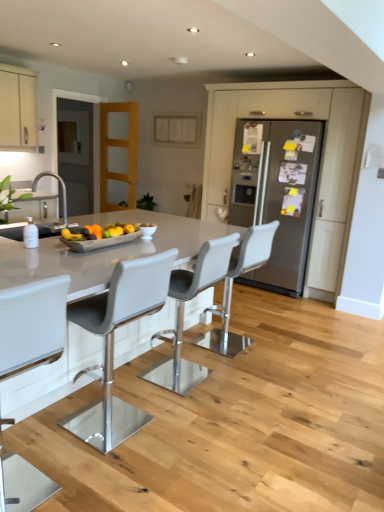
You are a GUI agent. You are given a task and a screenshot of the screen. Output one action in this format:
    pyautogui.click(x=<x>, y=<y>)
    Task: Click on the vacant region in front of white leather bar stool at center, the second chair from the front
    
    Given the screenshot: What is the action you would take?
    (110, 475)